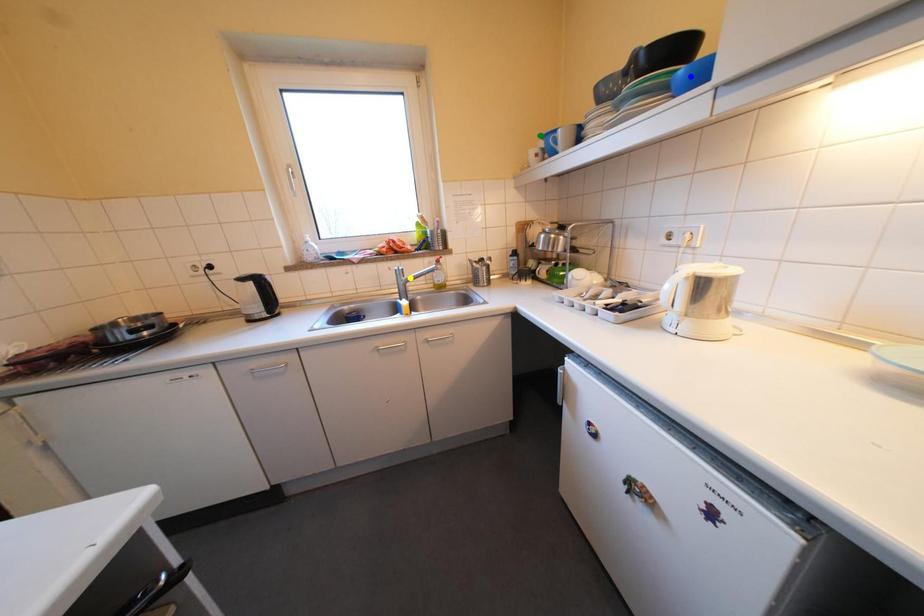
Order these from nearest to farthest:
yellow point, green point, blue point

blue point < green point < yellow point